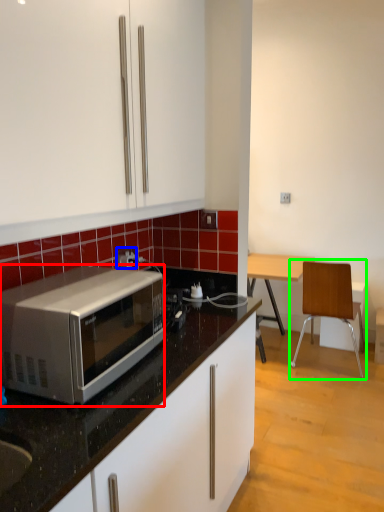
Question: Considering the real-world distances, which object is farthest from microwave oven (highlighted by a red box)? power outlet (highlighted by a blue box) or chair (highlighted by a green box)?

Choices:
 (A) power outlet
 (B) chair

Answer: (B)